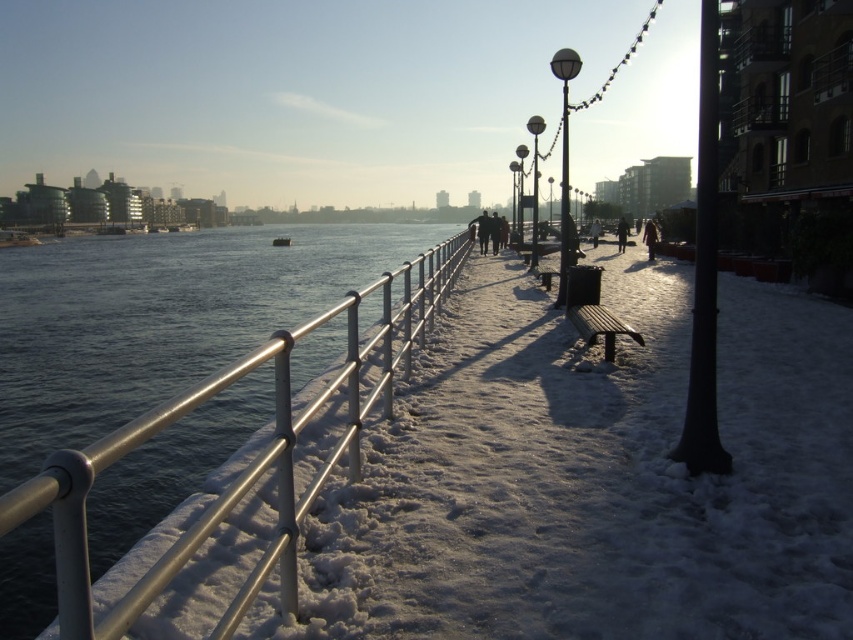
Question: Which is farther from the metallic pole at center?

Choices:
 (A) matte black lamp post at center
 (B) black matte pole at right
 (C) glossy metal lamp post at center
 (D) brushed metal railing at left

Answer: (A)

Question: Is satin black lamp post at upper center to the left of metallic pole at center-right from the viewer's perspective?

Choices:
 (A) yes
 (B) no

Answer: (B)

Question: Which object is the farthest from the satin black lamp post at upper center?

Choices:
 (A) glossy metal lamp post at center
 (B) black matte pole at right

Answer: (B)

Question: Which object appears farthest from the camera in this image?

Choices:
 (A) matte black lamp post at center
 (B) wooden bench at center
 (C) black matte pole at right

Answer: (A)

Question: Is metallic pole at center-right smaller than metallic pole at center?

Choices:
 (A) yes
 (B) no

Answer: (B)

Question: Can you confirm if satin black lamp post at upper center is bigger than glossy metal lamp post at center?

Choices:
 (A) no
 (B) yes

Answer: (B)